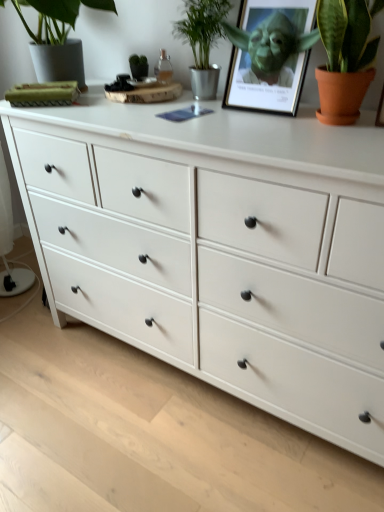
This screenshot has height=512, width=384. Describe the element at coordinates (345, 57) in the screenshot. I see `terracotta clay pot at upper right, acting as the first houseplant starting from the right` at that location.

Describe the element at coordinates (58, 37) in the screenshot. Image resolution: width=384 pixels, height=512 pixels. I see `green matte plant at upper left, positioned as the third houseplant in right-to-left order` at that location.

What do you see at coordinates (269, 55) in the screenshot?
I see `matte green picture frame at upper center` at bounding box center [269, 55].

Measure the distance between matte green picture frame at upper center and camera.

matte green picture frame at upper center is 1.10 meters from camera.

The image size is (384, 512). I want to click on terracotta clay pot at upper right, acting as the first houseplant starting from the right, so click(x=345, y=57).

Is green matte plant at upper left, the 1th houseplant positioned from the left, far away from terracotta clay pot at upper right, acting as the first houseplant starting from the right?

No, green matte plant at upper left, the 1th houseplant positioned from the left, is not far from terracotta clay pot at upper right, acting as the first houseplant starting from the right.

Can you tell me how much green matte plant at upper left, the 1th houseplant positioned from the left, and terracotta clay pot at upper right, acting as the first houseplant starting from the right, differ in facing direction?

9.59e-05 degrees separate the facing orientations of green matte plant at upper left, the 1th houseplant positioned from the left, and terracotta clay pot at upper right, acting as the first houseplant starting from the right.

Which is behind, point (72, 13) or point (341, 116)?

The point (72, 13) is farther.

Considering the sizes of objects green matte plant at upper left, the 1th houseplant positioned from the left, and terracotta clay pot at upper right, acting as the first houseplant starting from the right, in the image provided, who is thinner, green matte plant at upper left, the 1th houseplant positioned from the left, or terracotta clay pot at upper right, acting as the first houseplant starting from the right,?

terracotta clay pot at upper right, acting as the first houseplant starting from the right.

From the image's perspective, which is above, green metallic plant at upper center, the 2th houseplant positioned from the left, or matte green picture frame at upper center?

From the image's view, green metallic plant at upper center, the 2th houseplant positioned from the left, is above.

Is green metallic plant at upper center, the 2th houseplant positioned from the left, smaller than matte green picture frame at upper center?

Yes.

From a real-world perspective, which object stands above the other?

From a 3D spatial view, green metallic plant at upper center, arranged as the second houseplant when viewed from the right, is above.

Considering the sizes of objects green metallic plant at upper center, the 2th houseplant positioned from the left, and matte green picture frame at upper center in the image provided, who is wider, green metallic plant at upper center, the 2th houseplant positioned from the left, or matte green picture frame at upper center?

With larger width is green metallic plant at upper center, the 2th houseplant positioned from the left.

Is green matte plant at upper left, the 1th houseplant positioned from the left, behind matte green picture frame at upper center?

No, the depth of green matte plant at upper left, the 1th houseplant positioned from the left, is less than that of matte green picture frame at upper center.

From the image's perspective, who appears lower, green matte plant at upper left, the 1th houseplant positioned from the left, or matte green picture frame at upper center?

matte green picture frame at upper center.

Is green matte plant at upper left, positioned as the third houseplant in right-to-left order, oriented away from matte green picture frame at upper center?

That's not correct — green matte plant at upper left, positioned as the third houseplant in right-to-left order, is not looking away from matte green picture frame at upper center.

The height and width of the screenshot is (512, 384). What are the coordinates of `houseplant on the right of matte green picture frame at upper center` in the screenshot? It's located at (345, 57).

Is terracotta clay pot at upper right, the third houseplant in the left-to-right sequence, facing away from matte green picture frame at upper center?

No, terracotta clay pot at upper right, the third houseplant in the left-to-right sequence,'s orientation is not away from matte green picture frame at upper center.

From a real-world perspective, between terracotta clay pot at upper right, acting as the first houseplant starting from the right, and matte green picture frame at upper center, who is vertically higher?

terracotta clay pot at upper right, acting as the first houseplant starting from the right, from a real-world perspective.

Is terracotta clay pot at upper right, the third houseplant in the left-to-right sequence, positioned before matte green picture frame at upper center?

Yes, the depth of terracotta clay pot at upper right, the third houseplant in the left-to-right sequence, is less than that of matte green picture frame at upper center.

Considering the sizes of objects terracotta clay pot at upper right, acting as the first houseplant starting from the right, and green matte plant at upper left, the 1th houseplant positioned from the left, in the image provided, who is bigger, terracotta clay pot at upper right, acting as the first houseplant starting from the right, or green matte plant at upper left, the 1th houseplant positioned from the left,?

Bigger between the two is green matte plant at upper left, the 1th houseplant positioned from the left.

Would you consider terracotta clay pot at upper right, the third houseplant in the left-to-right sequence, to be distant from green matte plant at upper left, the 1th houseplant positioned from the left?

→ terracotta clay pot at upper right, the third houseplant in the left-to-right sequence, is actually quite close to green matte plant at upper left, the 1th houseplant positioned from the left.

Is terracotta clay pot at upper right, acting as the first houseplant starting from the right, positioned in front of green matte plant at upper left, positioned as the third houseplant in right-to-left order?

Yes, terracotta clay pot at upper right, acting as the first houseplant starting from the right, is closer to the camera.

Is terracotta clay pot at upper right, the third houseplant in the left-to-right sequence, oriented towards green matte plant at upper left, the 1th houseplant positioned from the left?

No, terracotta clay pot at upper right, the third houseplant in the left-to-right sequence, is not turned towards green matte plant at upper left, the 1th houseplant positioned from the left.

Is green metallic plant at upper center, arranged as the second houseplant when viewed from the right, facing away from terracotta clay pot at upper right, acting as the first houseplant starting from the right?

No.

Is green metallic plant at upper center, the 2th houseplant positioned from the left, touching terracotta clay pot at upper right, the third houseplant in the left-to-right sequence?

No, green metallic plant at upper center, the 2th houseplant positioned from the left, is not beside terracotta clay pot at upper right, the third houseplant in the left-to-right sequence.

The width and height of the screenshot is (384, 512). I want to click on houseplant that is the 2nd object located in front of the green metallic plant at upper center, arranged as the second houseplant when viewed from the right, so click(345, 57).

From the image's perspective, is green metallic plant at upper center, arranged as the second houseplant when viewed from the right, below terracotta clay pot at upper right, the third houseplant in the left-to-right sequence?

Incorrect, from the image's perspective, green metallic plant at upper center, arranged as the second houseplant when viewed from the right, is higher than terracotta clay pot at upper right, the third houseplant in the left-to-right sequence.

Do you think green metallic plant at upper center, the 2th houseplant positioned from the left, is within green matte plant at upper left, the 1th houseplant positioned from the left, or outside of it?

green metallic plant at upper center, the 2th houseplant positioned from the left, is not enclosed by green matte plant at upper left, the 1th houseplant positioned from the left.

How different are the orientations of green metallic plant at upper center, arranged as the second houseplant when viewed from the right, and green matte plant at upper left, positioned as the third houseplant in right-to-left order, in degrees?

The facing directions of green metallic plant at upper center, arranged as the second houseplant when viewed from the right, and green matte plant at upper left, positioned as the third houseplant in right-to-left order, are 0.000201 degrees apart.

Does green metallic plant at upper center, arranged as the second houseplant when viewed from the right, turn towards green matte plant at upper left, the 1th houseplant positioned from the left?

No, green metallic plant at upper center, arranged as the second houseplant when viewed from the right, is not turned towards green matte plant at upper left, the 1th houseplant positioned from the left.

From the image's perspective, between green metallic plant at upper center, the 2th houseplant positioned from the left, and green matte plant at upper left, positioned as the third houseplant in right-to-left order, which one is located above?

green matte plant at upper left, positioned as the third houseplant in right-to-left order, appears higher in the image.

This screenshot has width=384, height=512. There is a green matte plant at upper left, positioned as the third houseplant in right-to-left order. What are the coordinates of `the 1st houseplant below it (from a real-world perspective)` in the screenshot? It's located at (345, 57).

Where is `picture frame below the green metallic plant at upper center, arranged as the second houseplant when viewed from the right (from the image's perspective)`? This screenshot has width=384, height=512. picture frame below the green metallic plant at upper center, arranged as the second houseplant when viewed from the right (from the image's perspective) is located at coordinates (269, 55).

When comparing their distances from green metallic plant at upper center, the 2th houseplant positioned from the left, does green matte plant at upper left, positioned as the third houseplant in right-to-left order, or terracotta clay pot at upper right, acting as the first houseplant starting from the right, seem closer?

Among the two, green matte plant at upper left, positioned as the third houseplant in right-to-left order, is located nearer to green metallic plant at upper center, the 2th houseplant positioned from the left.

Looking at the image, which one is located closer to green metallic plant at upper center, the 2th houseplant positioned from the left, terracotta clay pot at upper right, the third houseplant in the left-to-right sequence, or green matte plant at upper left, the 1th houseplant positioned from the left?

green matte plant at upper left, the 1th houseplant positioned from the left, lies closer to green metallic plant at upper center, the 2th houseplant positioned from the left, than the other object.

Based on their spatial positions, is green metallic plant at upper center, the 2th houseplant positioned from the left, or terracotta clay pot at upper right, acting as the first houseplant starting from the right, closer to green matte plant at upper left, positioned as the third houseplant in right-to-left order?

The object closer to green matte plant at upper left, positioned as the third houseplant in right-to-left order, is green metallic plant at upper center, the 2th houseplant positioned from the left.

Looking at this image, looking at the image, which one is located further to green matte plant at upper left, the 1th houseplant positioned from the left, terracotta clay pot at upper right, acting as the first houseplant starting from the right, or matte green picture frame at upper center?

terracotta clay pot at upper right, acting as the first houseplant starting from the right.

When comparing their distances from matte green picture frame at upper center, does terracotta clay pot at upper right, the third houseplant in the left-to-right sequence, or green metallic plant at upper center, arranged as the second houseplant when viewed from the right, seem further?

Based on the image, terracotta clay pot at upper right, the third houseplant in the left-to-right sequence, appears to be further to matte green picture frame at upper center.

Looking at the image, which one is located closer to terracotta clay pot at upper right, the third houseplant in the left-to-right sequence, matte green picture frame at upper center or green matte plant at upper left, the 1th houseplant positioned from the left?

The object closer to terracotta clay pot at upper right, the third houseplant in the left-to-right sequence, is matte green picture frame at upper center.

Looking at the image, which one is located further to green matte plant at upper left, positioned as the third houseplant in right-to-left order, terracotta clay pot at upper right, acting as the first houseplant starting from the right, or green metallic plant at upper center, arranged as the second houseplant when viewed from the right?

terracotta clay pot at upper right, acting as the first houseplant starting from the right, is positioned further to the anchor green matte plant at upper left, positioned as the third houseplant in right-to-left order.

Based on the photo, based on their spatial positions, is green metallic plant at upper center, arranged as the second houseplant when viewed from the right, or matte green picture frame at upper center further from terracotta clay pot at upper right, the third houseplant in the left-to-right sequence?

green metallic plant at upper center, arranged as the second houseplant when viewed from the right, is further to terracotta clay pot at upper right, the third houseplant in the left-to-right sequence.

Locate an element on the screen. picture frame between green metallic plant at upper center, arranged as the second houseplant when viewed from the right, and terracotta clay pot at upper right, the third houseplant in the left-to-right sequence is located at coordinates (269, 55).

Where is `houseplant between green matte plant at upper left, the 1th houseplant positioned from the left, and terracotta clay pot at upper right, acting as the first houseplant starting from the right, in the horizontal direction`? houseplant between green matte plant at upper left, the 1th houseplant positioned from the left, and terracotta clay pot at upper right, acting as the first houseplant starting from the right, in the horizontal direction is located at coordinates (202, 41).

Locate an element on the screen. houseplant between green matte plant at upper left, the 1th houseplant positioned from the left, and matte green picture frame at upper center, in the horizontal direction is located at coordinates (202, 41).

The height and width of the screenshot is (512, 384). Identify the location of picture frame between green matte plant at upper left, the 1th houseplant positioned from the left, and terracotta clay pot at upper right, acting as the first houseplant starting from the right. (269, 55).